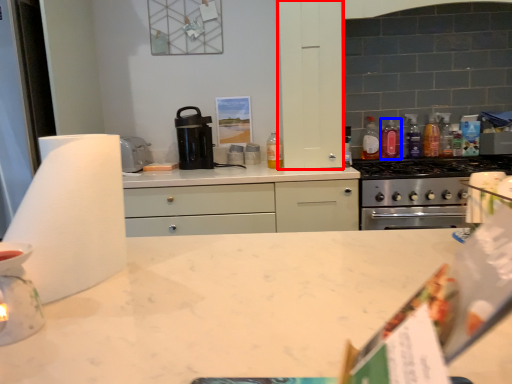
Question: Which object appears closest to the camera in this image, cabinetry (highlighted by a red box) or bottle (highlighted by a blue box)?

Choices:
 (A) cabinetry
 (B) bottle

Answer: (A)